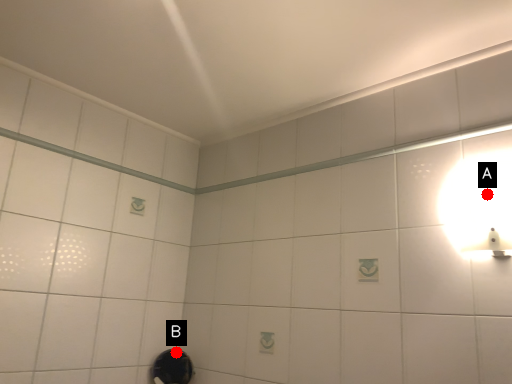
Question: Two points are circled on the image, labeled by A and B beside each circle. Which of the following is the farthest from the observer?

Choices:
 (A) A is further
 (B) B is further

Answer: (B)